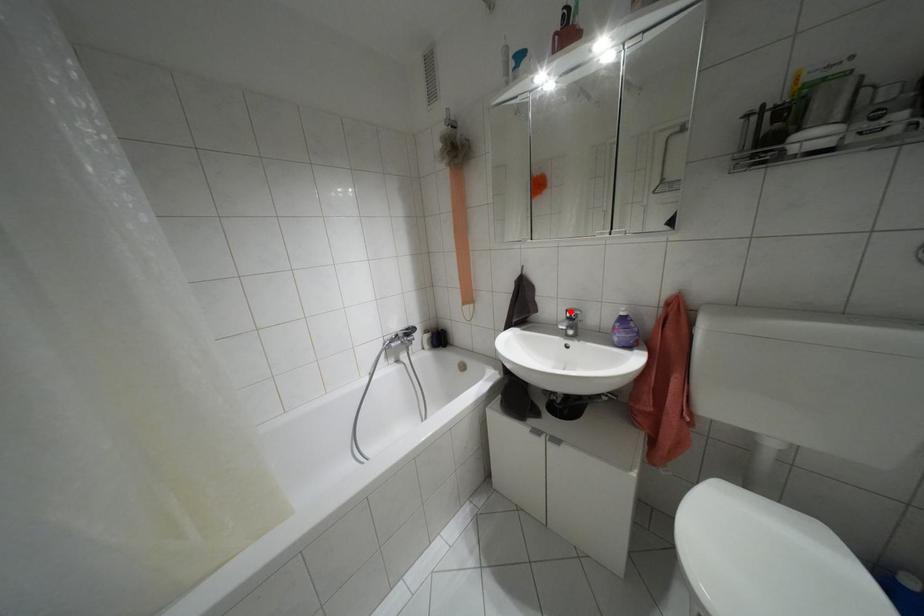
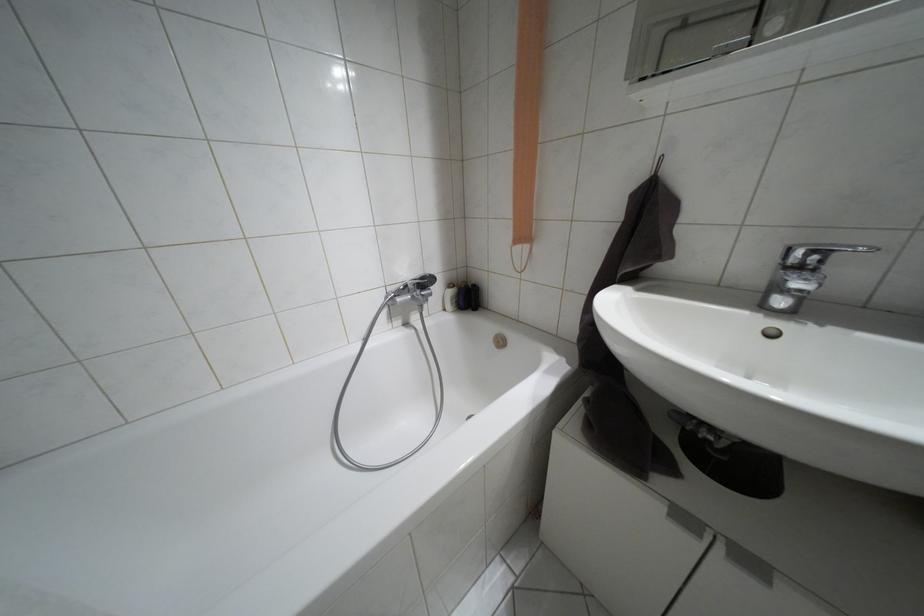
Locate, in the second image, the point that corresponds to the highlighted location in the first image.

(810, 253)